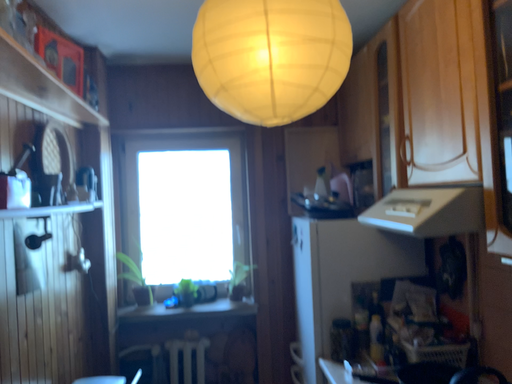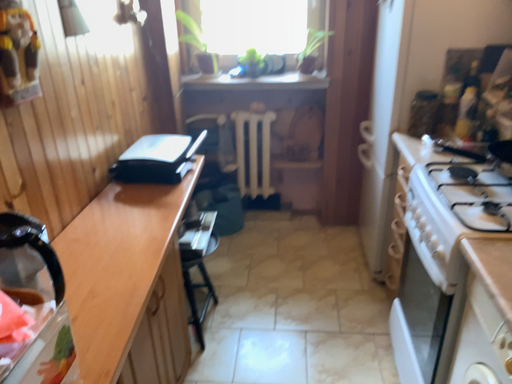
Question: How did the camera likely rotate when shooting the video?

Choices:
 (A) rotated downward
 (B) rotated upward

Answer: (A)